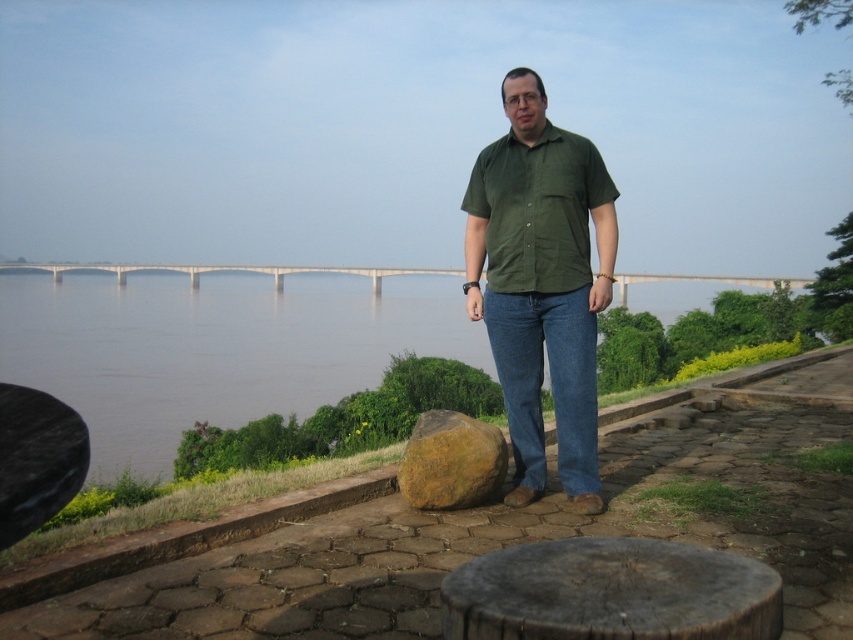
Question: Considering the relative positions of green matte shirt at center and green cotton shirt at center in the image provided, where is green matte shirt at center located with respect to green cotton shirt at center?

Choices:
 (A) left
 (B) right

Answer: (B)

Question: Does green matte shirt at center have a smaller size compared to dark brown wood stool at lower center?

Choices:
 (A) no
 (B) yes

Answer: (A)

Question: Is green matte shirt at center below dark brown wood stool at lower center?

Choices:
 (A) yes
 (B) no

Answer: (B)

Question: Which point appears closest to the camera in this image?

Choices:
 (A) (279, 381)
 (B) (476, 188)

Answer: (B)

Question: Which object is closer to the camera taking this photo?

Choices:
 (A) brown rough rock at center
 (B) brown muddy water at center
 (C) green matte shirt at center
 (D) green cotton shirt at center

Answer: (B)

Question: Which object is the farthest from the brown muddy water at center?

Choices:
 (A) green matte shirt at center
 (B) brown rough rock at center

Answer: (A)